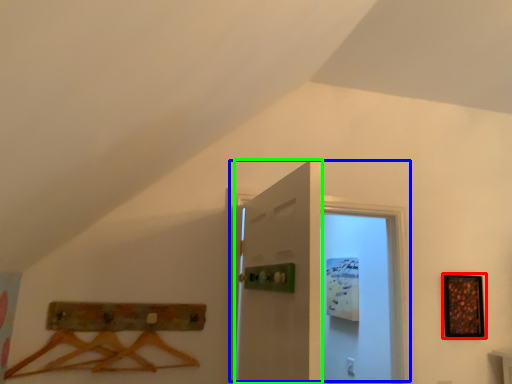
Question: Considering the real-world distances, which object is closest to picture frame (highlighted by a red box)? door (highlighted by a blue box) or door (highlighted by a green box).

Choices:
 (A) door
 (B) door

Answer: (A)